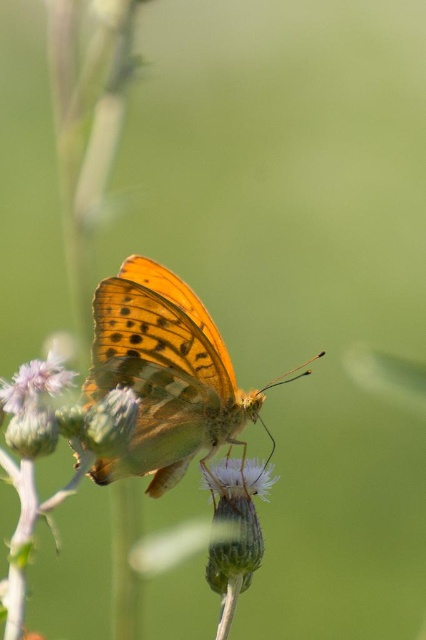
Looking at the image, there is an orange translucent wings at center and a white fuzzy flower at center. Which one is positioned to the left side?

The orange translucent wings at center are to the left of the white fuzzy flower at center.

You are a photographer aiming to capture the soft purple flower at center in your shot. Based on the coordinates provided, where should you focus your camera lens to ensure the flower is in sharp focus?

You should focus your camera lens at point (x=111, y=420) to ensure the soft purple flower at center is in sharp focus.

You are a photographer aiming to capture the orange translucent wings at center and the white fuzzy flower at center in a single frame. Based on their sizes, which object will occupy more space in your photo?

The orange translucent wings at center will occupy more space in the photo because their width surpasses that of the white fuzzy flower at center.